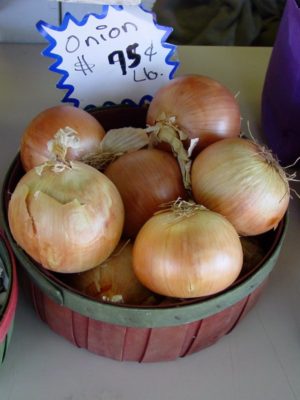
At what (x,y) coordinates should I click in order to perform the action: click on basket handle. Please return your answer as a coordinate pair (x, y). This screenshot has width=300, height=400. Looking at the image, I should click on (35, 280).